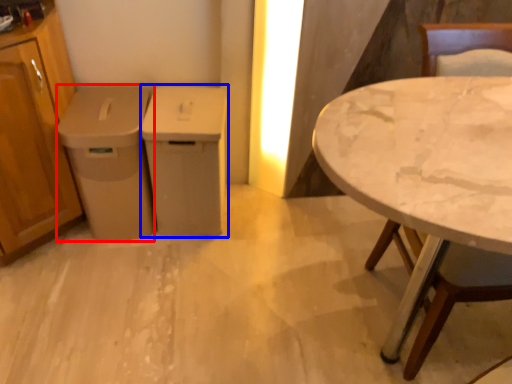
Question: Among these objects, which one is farthest to the camera, cabinetry (highlighted by a red box) or cabinetry (highlighted by a blue box)?

Choices:
 (A) cabinetry
 (B) cabinetry

Answer: (B)